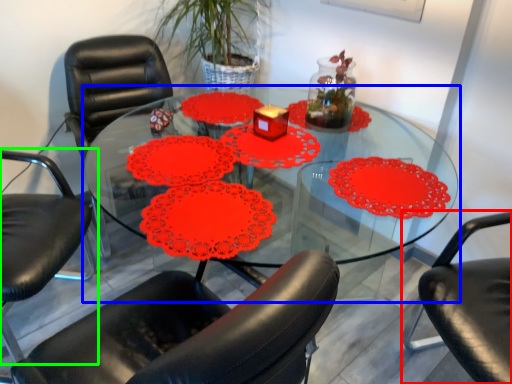
Question: Which is nearer to the chair (highlighted by a red box)? table (highlighted by a blue box) or chair (highlighted by a green box).

Choices:
 (A) table
 (B) chair

Answer: (A)